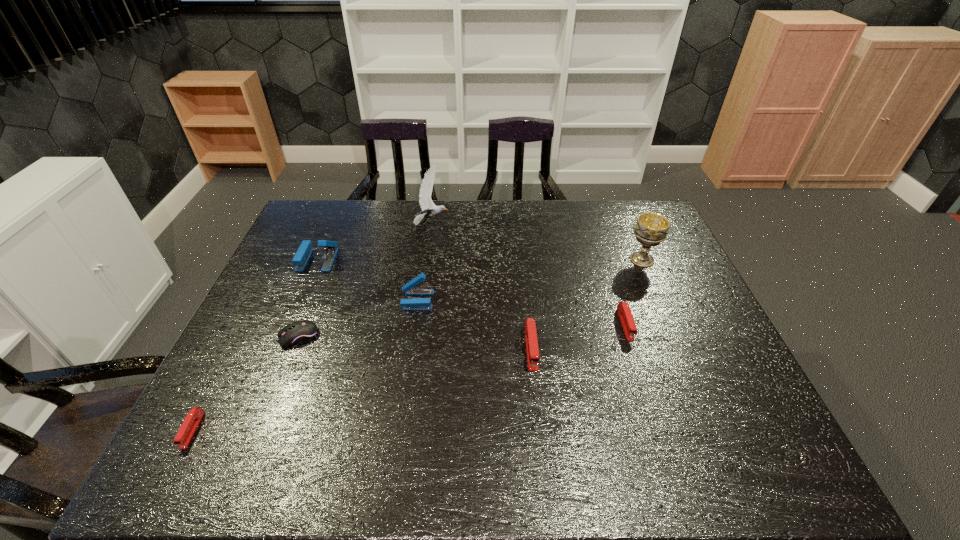
Locate an element on the screen. This screenshot has width=960, height=540. free space located on the front of the black computer mouse is located at coordinates (264, 423).

Locate an element on the screen. Image resolution: width=960 pixels, height=540 pixels. object situated at the far edge is located at coordinates (429, 209).

What are the coordinates of `object located in the near edge section of the desktop` in the screenshot? It's located at (193, 418).

You are a GUI agent. You are given a task and a screenshot of the screen. Output one action in this format:
    pyautogui.click(x=<x>, y=<y>)
    Task: Click on the computer mouse at the left edge
    This screenshot has width=960, height=540.
    Given the screenshot: What is the action you would take?
    pyautogui.click(x=300, y=332)

You are a GUI agent. You are given a task and a screenshot of the screen. Output one action in this format:
    pyautogui.click(x=<x>, y=<y>)
    Task: Click on the object at the right edge
    This screenshot has height=540, width=960.
    Given the screenshot: What is the action you would take?
    (651, 229)

The width and height of the screenshot is (960, 540). Identify the location of object situated at the near left corner. (193, 418).

I want to click on vacant space at the far edge of the desktop, so click(x=396, y=211).

Find the location of a particular element. The image size is (960, 540). vacant space at the near edge is located at coordinates (625, 457).

Where is `free space at the left edge of the desktop`? The width and height of the screenshot is (960, 540). free space at the left edge of the desktop is located at coordinates (272, 334).

Identify the location of free region at the right edge of the desktop. (705, 362).